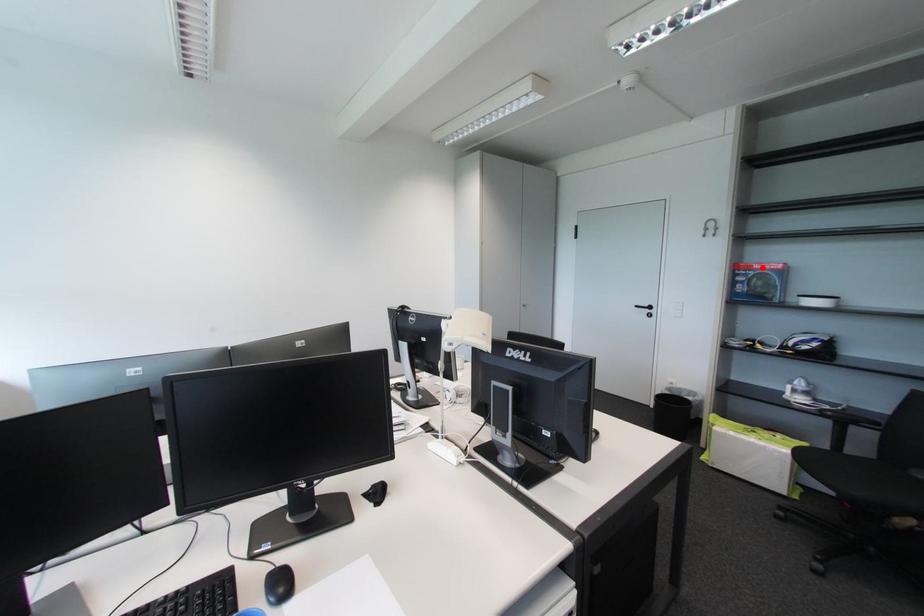
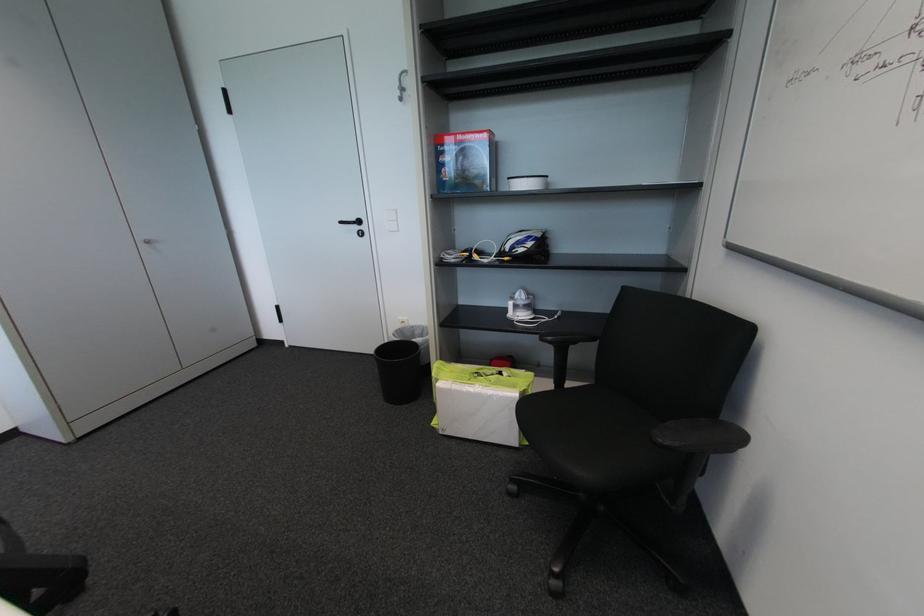
Locate, in the second image, the point that corresponds to the highlighted location in the first image.

(466, 139)